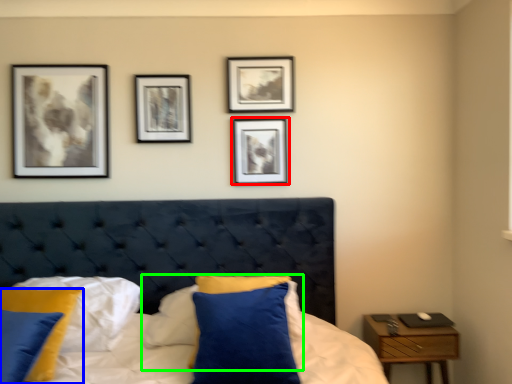
Question: Which object is positioned farthest from picture frame (highlighted by a red box)? Select from pillow (highlighted by a blue box) and pillow (highlighted by a green box).

Choices:
 (A) pillow
 (B) pillow

Answer: (A)